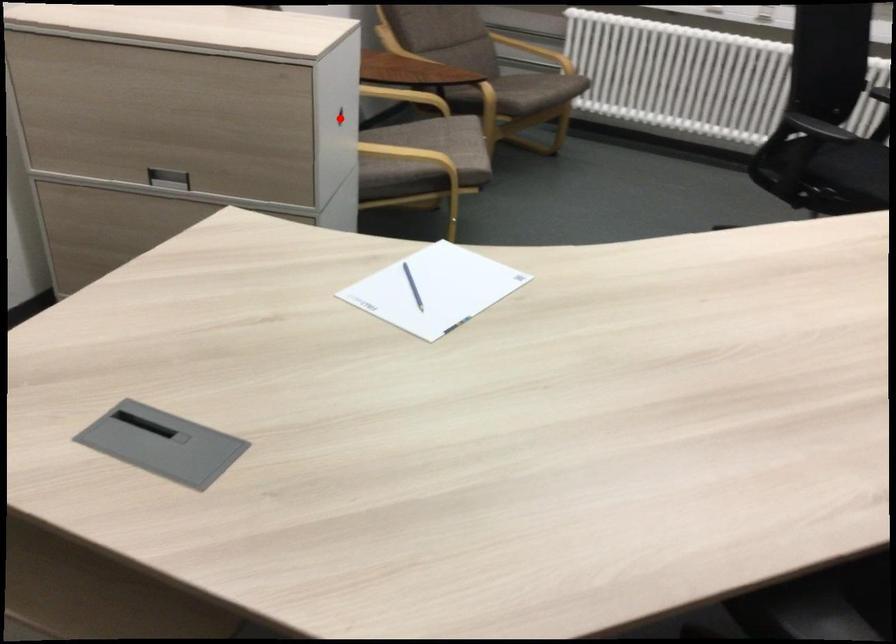
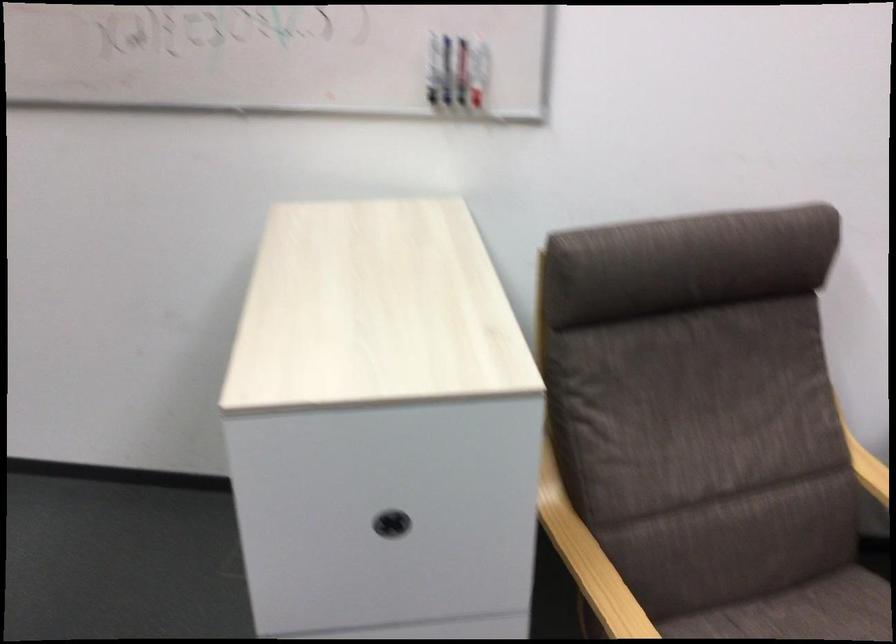
In the second image, find the point that corresponds to the highlighted location in the first image.

(391, 524)